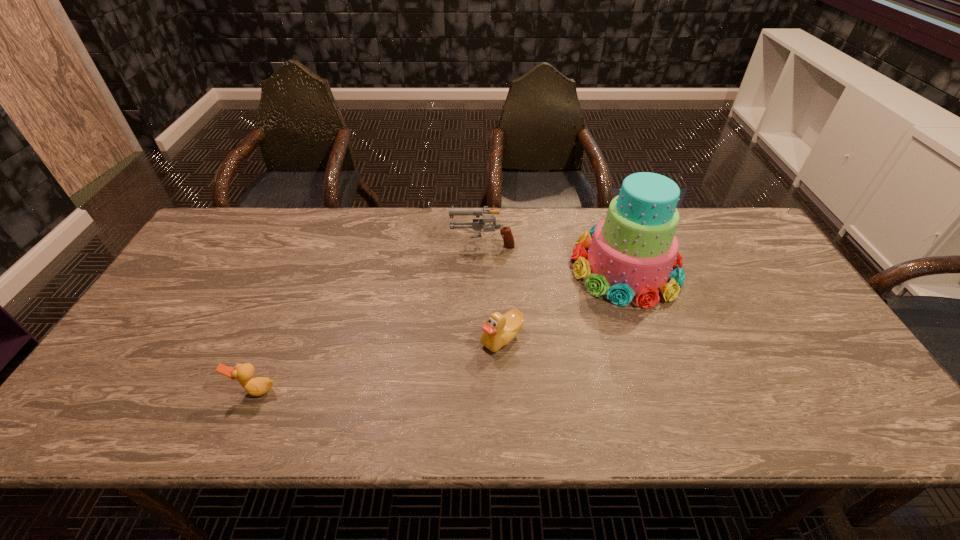
Find the location of a particular element. vacant space located at the barrel end of the third shortest object is located at coordinates point(382,243).

Find the location of a particular element. The height and width of the screenshot is (540, 960). vacant space situated at the beak of the farther duck is located at coordinates (461, 338).

In order to click on blank area located 0.360m at the beak of the farther duck in this screenshot , I will do `click(339, 338)`.

Find the location of a particular element. blank space located at the beak of the farther duck is located at coordinates (343, 338).

Where is `vacant area located 0.090m on the beak of the leftmost object`? vacant area located 0.090m on the beak of the leftmost object is located at coordinates (236, 437).

Locate an element on the screen. Image resolution: width=960 pixels, height=540 pixels. cake present at the far edge is located at coordinates (633, 250).

Where is `gun that is at the far edge`? gun that is at the far edge is located at coordinates (478, 224).

The height and width of the screenshot is (540, 960). Identify the location of vacant space at the far edge. (322, 241).

Find the location of a particular element. vacant space at the near edge of the desktop is located at coordinates (413, 406).

In the image, there is a desktop. Identify the location of blank space at the right edge. [x=783, y=365].